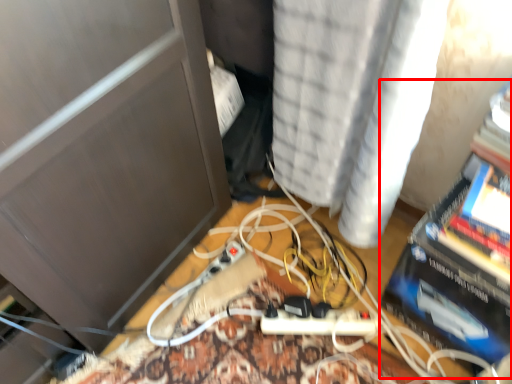
Question: Where is paperback book (annotated by the red box) located in relation to curtain in the image?

Choices:
 (A) right
 (B) left

Answer: (A)